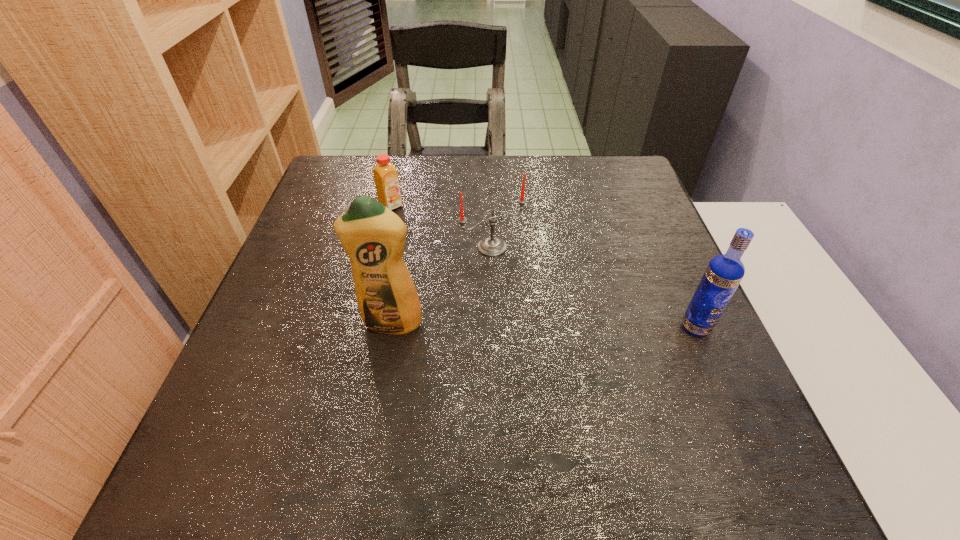
Locate an element on the screen. free space on the desktop that is between the detergent and the second tallest object and is positioned on the front and back of the shortest object is located at coordinates (541, 326).

Identify the location of free space on the desktop that is between the detergent and the second tallest object and is positioned on the front-facing side of the candle. This screenshot has width=960, height=540. (561, 326).